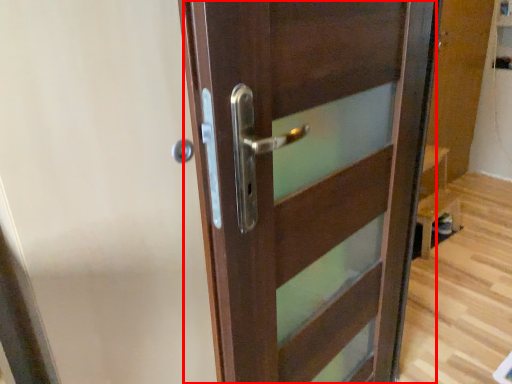
Question: From the image's perspective, what is the correct spatial positioning of door (annotated by the red box) in reference to screen door?

Choices:
 (A) below
 (B) above

Answer: (A)